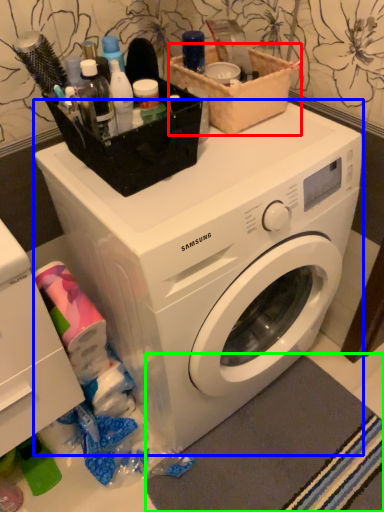
Question: Which object is positioned farthest from basket (highlighted by a red box)? Select from washing machine (highlighted by a blue box) and bath mat (highlighted by a green box).

Choices:
 (A) washing machine
 (B) bath mat

Answer: (B)